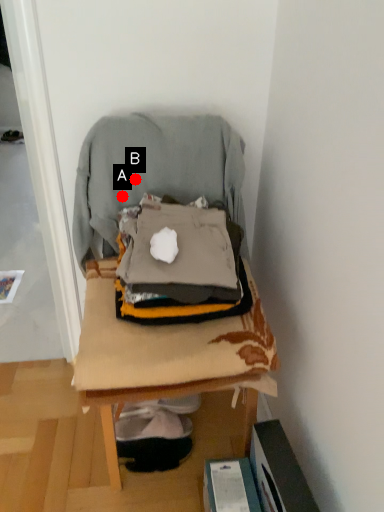
Question: Two points are circled on the image, labeled by A and B beside each circle. Which point is farther from the camera taking this photo?

Choices:
 (A) A is further
 (B) B is further

Answer: (A)